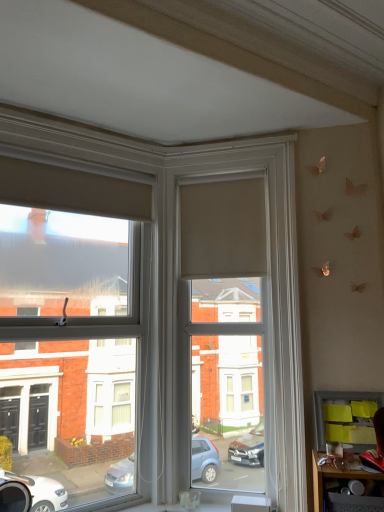
What do you see at coordinates (334, 477) in the screenshot?
I see `matte black table at lower right` at bounding box center [334, 477].

Where is `matte beige roller blind at center`? matte beige roller blind at center is located at coordinates (70, 330).

From the image's perspective, would you say matte beige roller blind at center is shown under matte black table at lower right?

Actually, matte beige roller blind at center appears above matte black table at lower right in the image.

Based on their sizes in the image, would you say matte beige roller blind at center is bigger or smaller than matte black table at lower right?

matte beige roller blind at center is bigger than matte black table at lower right.

Is point (85, 271) behind point (362, 471)?

Yes, point (85, 271) is behind point (362, 471).

From a real-world perspective, which is physically above, matte beige roller blind at center or matte black table at lower right?

In real-world perspective, matte beige roller blind at center is above.

Who is shorter, yellow sticky notes at lower right or matte black table at lower right?

Standing shorter between the two is matte black table at lower right.

At what (x,y) coordinates should I click in order to perform the action: click on shelf above the matte black table at lower right (from the image's perspective). Please return your answer as a coordinate pair (x, y). Image resolution: width=384 pixels, height=512 pixels. Looking at the image, I should click on (345, 418).

Is yellow sticky notes at lower right situated inside matte black table at lower right or outside?

yellow sticky notes at lower right cannot be found inside matte black table at lower right.

Would you say yellow sticky notes at lower right is to the left or to the right of matte black table at lower right in the picture?

Clearly, yellow sticky notes at lower right is on the right of matte black table at lower right in the image.

Is yellow sticky notes at lower right positioned far away from matte beige roller blind at center?

No, yellow sticky notes at lower right is in close proximity to matte beige roller blind at center.

Does yellow sticky notes at lower right come in front of matte beige roller blind at center?

Yes, yellow sticky notes at lower right is closer to the viewer.

From a real-world perspective, is yellow sticky notes at lower right positioned under matte beige roller blind at center based on gravity?

Indeed, from a real-world perspective, yellow sticky notes at lower right is positioned beneath matte beige roller blind at center.

Find the location of a particular element. shelf in front of the matte beige roller blind at center is located at coordinates (345, 418).

Is matte black table at lower right spatially inside matte beige roller blind at center, or outside of it?

The correct answer is: outside.

Is matte black table at lower right in contact with matte beige roller blind at center?

No, matte black table at lower right is not beside matte beige roller blind at center.

From a real-world perspective, is matte black table at lower right on top of matte beige roller blind at center?

No, from a real-world perspective, matte black table at lower right is not on top of matte beige roller blind at center.

Is matte black table at lower right aimed at matte beige roller blind at center?

No, matte black table at lower right does not turn towards matte beige roller blind at center.

From the image's perspective, who appears lower, matte beige roller blind at center or matte beige roller blind at center?

matte beige roller blind at center.

Does matte beige roller blind at center turn towards matte beige roller blind at center?

No, matte beige roller blind at center is not aimed at matte beige roller blind at center.

Is matte beige roller blind at center at the right side of matte beige roller blind at center?

No.

Is matte beige roller blind at center shorter than matte beige roller blind at center?

In fact, matte beige roller blind at center may be taller than matte beige roller blind at center.

Is matte beige roller blind at center inside or outside of matte beige roller blind at center?

The correct answer is: outside.

Considering the sizes of objects matte beige roller blind at center and matte beige roller blind at center in the image provided, who is shorter, matte beige roller blind at center or matte beige roller blind at center?

matte beige roller blind at center is shorter.

How distant is matte beige roller blind at center from matte beige roller blind at center?

matte beige roller blind at center and matte beige roller blind at center are 25.08 inches apart from each other.

From a real-world perspective, which object stands above the other?

matte beige roller blind at center, from a real-world perspective.

Is matte beige roller blind at center next to yellow sticky notes at lower right and touching it?

No, matte beige roller blind at center is not next to yellow sticky notes at lower right.

Would you say matte beige roller blind at center is inside or outside yellow sticky notes at lower right?

matte beige roller blind at center is outside yellow sticky notes at lower right.

Is matte beige roller blind at center bigger than yellow sticky notes at lower right?

Yes.

I want to click on window behind the matte black table at lower right, so click(70, 330).

This screenshot has height=512, width=384. I want to click on table on the left of yellow sticky notes at lower right, so click(x=334, y=477).

When comparing their distances from matte beige roller blind at center, does matte beige roller blind at center or matte black table at lower right seem closer?

matte beige roller blind at center is positioned closer to the anchor matte beige roller blind at center.

From the image, which object appears to be nearer to yellow sticky notes at lower right, matte black table at lower right or matte beige roller blind at center?

The object closer to yellow sticky notes at lower right is matte black table at lower right.

Based on their spatial positions, is yellow sticky notes at lower right or matte black table at lower right closer to matte beige roller blind at center?

Based on the image, yellow sticky notes at lower right appears to be nearer to matte beige roller blind at center.

Considering their positions, is yellow sticky notes at lower right positioned closer to matte beige roller blind at center than matte beige roller blind at center?

Result: Based on the image, yellow sticky notes at lower right appears to be nearer to matte beige roller blind at center.

Looking at the image, which one is located further to matte beige roller blind at center, matte black table at lower right or yellow sticky notes at lower right?

matte black table at lower right.

Estimate the real-world distances between objects in this image. Which object is further from matte beige roller blind at center, matte beige roller blind at center or matte black table at lower right?

Among the two, matte black table at lower right is located further to matte beige roller blind at center.

Which object lies further to the anchor point matte black table at lower right, matte beige roller blind at center or yellow sticky notes at lower right?

matte beige roller blind at center.

Which object lies further to the anchor point yellow sticky notes at lower right, matte beige roller blind at center or matte black table at lower right?

matte beige roller blind at center lies further to yellow sticky notes at lower right than the other object.

Find the location of a particular element. Image resolution: width=384 pixels, height=512 pixels. table situated between matte beige roller blind at center and yellow sticky notes at lower right from left to right is located at coordinates (334, 477).

You are a GUI agent. You are given a task and a screenshot of the screen. Output one action in this format:
    pyautogui.click(x=<x>, y=<y>)
    Task: Click on the window screen located between matte beige roller blind at center and yellow sticky notes at lower right in the left-right direction
    This screenshot has width=384, height=512.
    Given the screenshot: What is the action you would take?
    pyautogui.click(x=228, y=322)

You are a GUI agent. You are given a task and a screenshot of the screen. Output one action in this format:
    pyautogui.click(x=<x>, y=<y>)
    Task: Click on the shelf that lies between matte beige roller blind at center and matte black table at lower right from top to bottom
    Image resolution: width=384 pixels, height=512 pixels.
    Given the screenshot: What is the action you would take?
    pyautogui.click(x=345, y=418)

Locate an element on the screen. window screen between matte beige roller blind at center and matte black table at lower right in the horizontal direction is located at coordinates (228, 322).